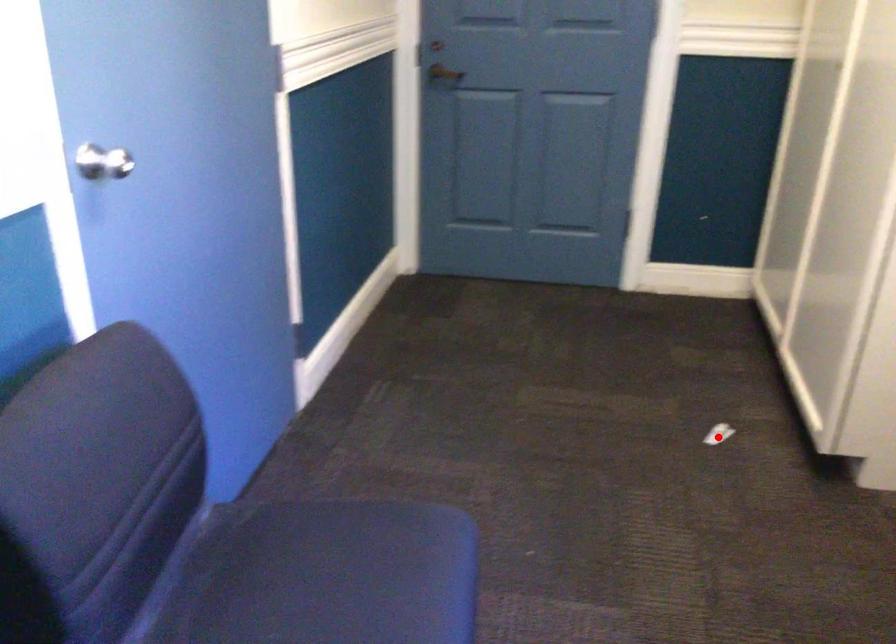
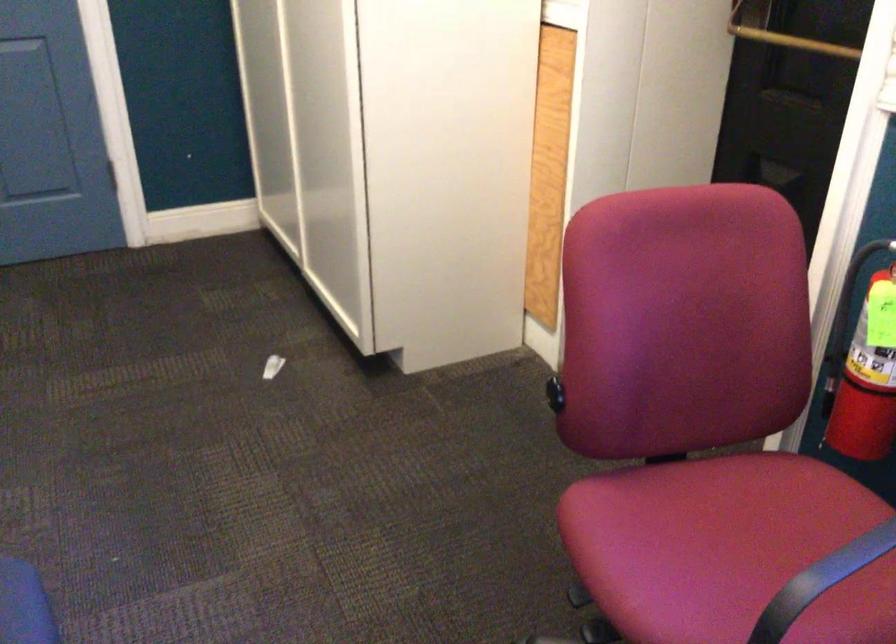
Find the pixel in the second image that matches the highlighted location in the first image.

(271, 366)